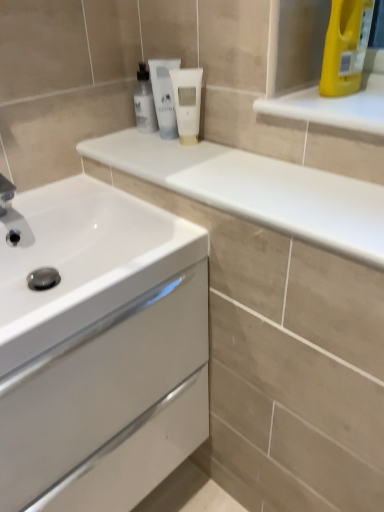
You are a GUI agent. You are given a task and a screenshot of the screen. Output one action in this format:
    pyautogui.click(x=<x>, y=<y>)
    Task: Click on the free location in front of white matte tube at center, the first mouthwash from the right
    The height and width of the screenshot is (512, 384).
    Given the screenshot: What is the action you would take?
    pyautogui.click(x=197, y=164)